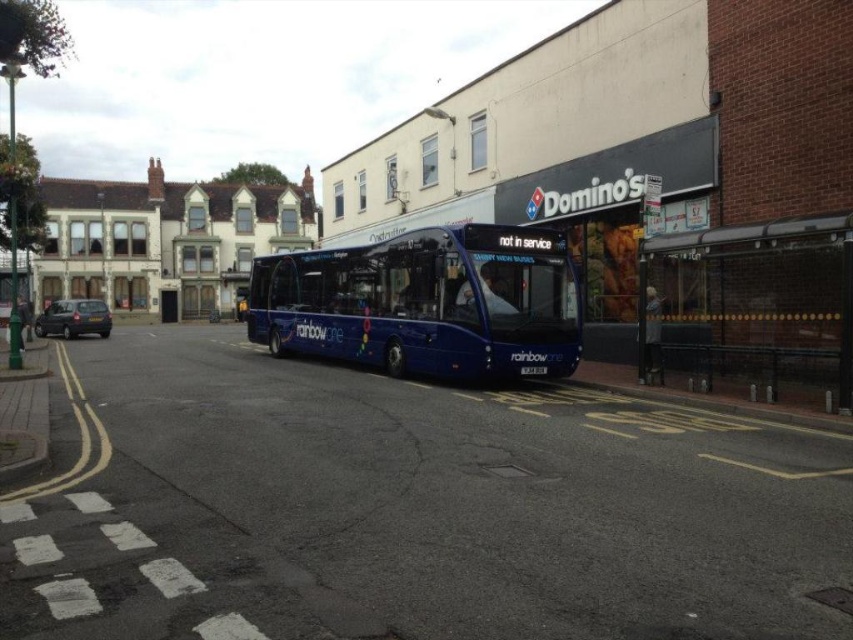
Which is more to the left, blue metallic bus at center or transparent plastic bus stop at right?

blue metallic bus at center

In the scene shown: Is blue metallic bus at center above transparent plastic bus stop at right?

No.

Find the location of `blue metallic bus at center`. blue metallic bus at center is located at coordinates (426, 301).

At what (x,y) coordinates should I click in order to perform the action: click on blue metallic bus at center. Please return your answer as a coordinate pair (x, y). The width and height of the screenshot is (853, 640). Looking at the image, I should click on (426, 301).